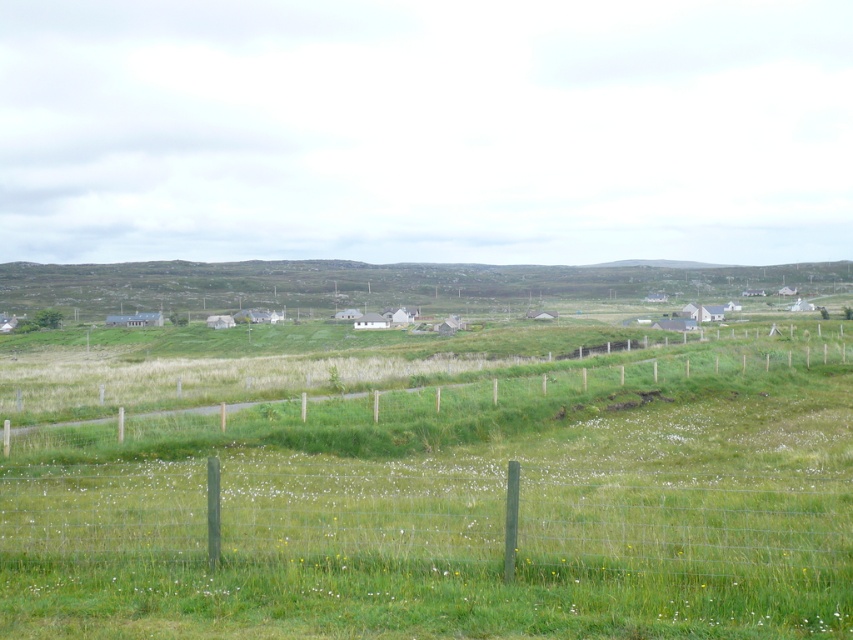
Question: Which point is farther to the camera?

Choices:
 (A) green wooden fence at center
 (B) green wire fence at lower center

Answer: (A)

Question: Which of the following is the closest to the observer?

Choices:
 (A) (138, 531)
 (B) (567, 371)

Answer: (A)

Question: In this image, where is green wire fence at lower center located relative to green wooden fence at center?

Choices:
 (A) above
 (B) below

Answer: (B)

Question: Can you confirm if green wire fence at lower center is positioned below green wooden fence at center?

Choices:
 (A) no
 (B) yes

Answer: (B)

Question: Does green wire fence at lower center have a smaller size compared to green wooden fence at center?

Choices:
 (A) no
 (B) yes

Answer: (B)

Question: Which point is farther to the camera?

Choices:
 (A) green wooden fence at center
 (B) green wire fence at lower center

Answer: (A)